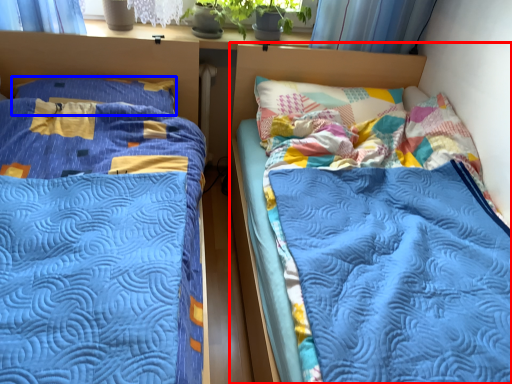
Question: Which point is closer to the camera, bed (highlighted by a red box) or pillow (highlighted by a blue box)?

Choices:
 (A) bed
 (B) pillow

Answer: (A)